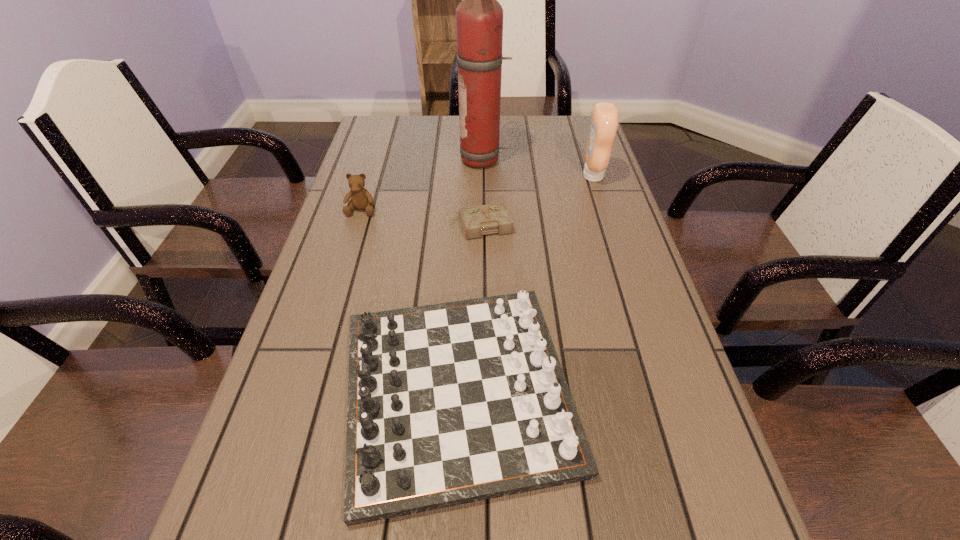
Identify the location of fire extinguisher. (479, 17).

Where is `the rightmost object`? the rightmost object is located at coordinates 604,122.

Identify the location of condiment. Image resolution: width=960 pixels, height=540 pixels. (604, 122).

The width and height of the screenshot is (960, 540). Find the location of `teddy bear`. teddy bear is located at coordinates (360, 198).

Image resolution: width=960 pixels, height=540 pixels. What are the coordinates of `chessboard` in the screenshot? It's located at (452, 403).

The width and height of the screenshot is (960, 540). What are the coordinates of `diary` in the screenshot? It's located at (493, 218).

Find the location of a particular element. This screenshot has height=540, width=960. vacant space located on the side of the tallest object with the label and nozzle is located at coordinates (395, 160).

This screenshot has width=960, height=540. What are the coordinates of `free space located 0.190m on the side of the tallest object with the label and nozzle` in the screenshot? It's located at (397, 160).

This screenshot has height=540, width=960. What are the coordinates of `vacant space located on the side of the tallest object with the label and nozzle` in the screenshot? It's located at point(368,160).

Identify the location of vacant space situated 0.240m on the label of the rightmost object. This screenshot has width=960, height=540. (498, 176).